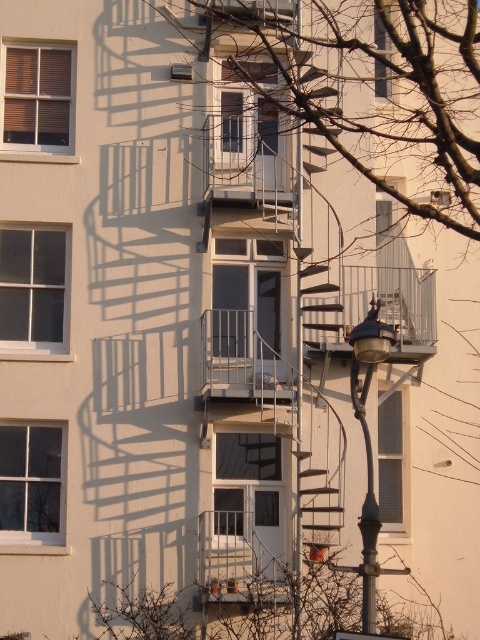
You are a window installer who needs to replace the clear glass window at center and the matte glass window at upper center. Which window should you replace first based on their positions?

You should replace the clear glass window at center first because it is below the matte glass window at upper center, so accessing it first would prevent obstructing the upper window during the replacement process.

You are a window cleaner who needs to clean both the metallic silver balcony at center and the matte brown window at upper left. Which object requires you to use a larger cleaning tool based on their sizes?

The metallic silver balcony at center requires a larger cleaning tool because it is larger in size than the matte brown window at upper left.